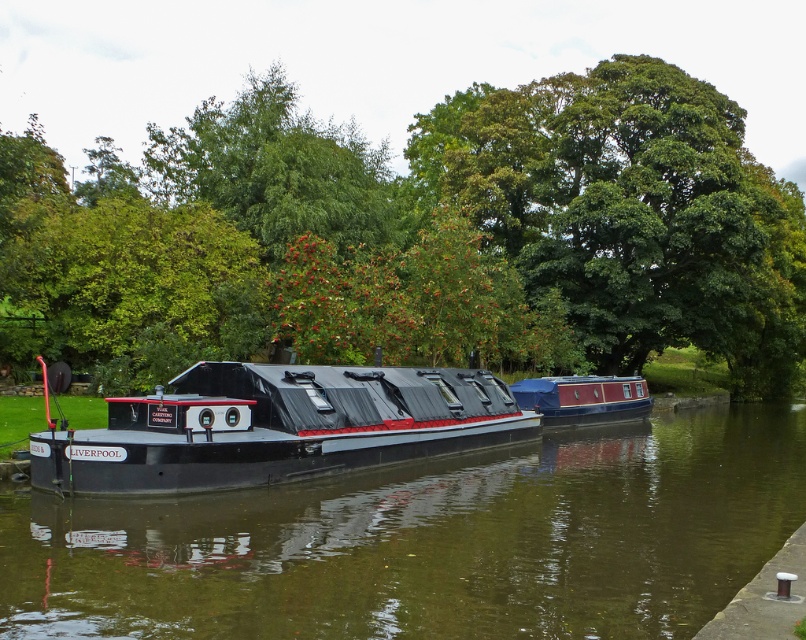
You are standing on the dock and want to take a photo of the blue painted wooden boat at center without the green leafy tree at center blocking the view. Is the tree currently blocking the boat?

The green leafy tree at center is in front of the blue painted wooden boat at center, so yes, the tree is blocking the view of the boat.

Looking at this image, you are a delivery person needing to move a 9.5 meter long package from the black matte barge at center to the blue painted wooden boat at center. Can you move the package between them without bending it?

The distance between the black matte barge at center and the blue painted wooden boat at center is 8.90 meters, so yes, the package can be moved without bending since it is shorter than the distance between them.

In the scene shown: You are standing on the dock and want to take a photo of both the green leafy tree at center and the blue painted wooden boat at center. Which object will appear larger in the photo?

The green leafy tree at center will appear larger in the photo because it is much taller than the blue painted wooden boat at center.